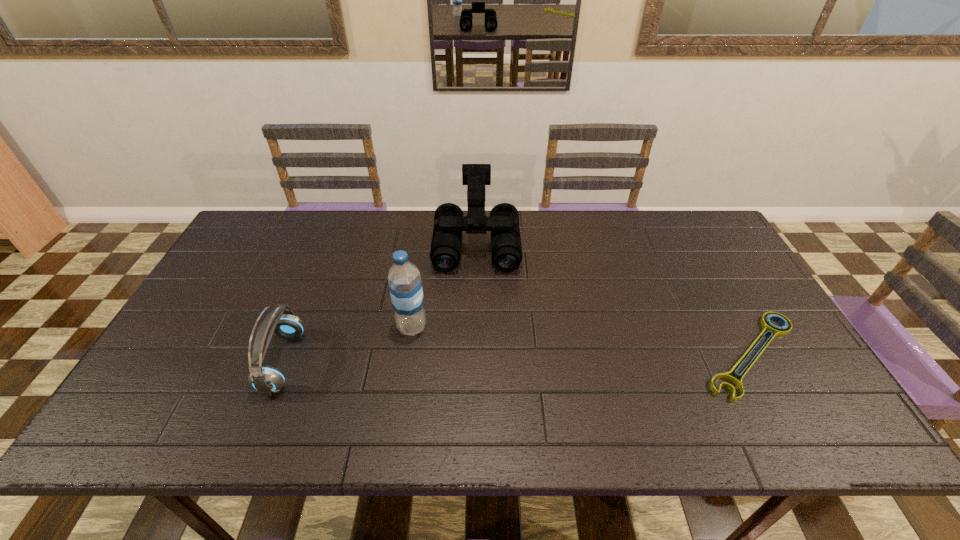
Find the location of a particular element. This screenshot has width=960, height=540. the leftmost object is located at coordinates (265, 379).

Locate an element on the screen. headset is located at coordinates (265, 379).

At what (x,y) coordinates should I click in order to perform the action: click on the rightmost object. Please return your answer as a coordinate pair (x, y). Looking at the image, I should click on (771, 329).

At what (x,y) coordinates should I click in order to perform the action: click on the shortest object. Please return your answer as a coordinate pair (x, y). Looking at the image, I should click on (771, 329).

At what (x,y) coordinates should I click in order to perform the action: click on water bottle. Please return your answer as a coordinate pair (x, y). Looking at the image, I should click on (405, 285).

You are a GUI agent. You are given a task and a screenshot of the screen. Output one action in this format:
    pyautogui.click(x=<x>, y=<y>)
    Task: Click on the binoculars
    This screenshot has height=540, width=960.
    Given the screenshot: What is the action you would take?
    pyautogui.click(x=506, y=249)

The image size is (960, 540). I want to click on the third shortest object, so click(506, 249).

Find the location of `vacant space located on the ear cups of the headset`. vacant space located on the ear cups of the headset is located at coordinates (216, 362).

The image size is (960, 540). Identify the location of free location located on the ear cups of the headset. (240, 362).

Image resolution: width=960 pixels, height=540 pixels. In order to click on free space located 0.110m on the ear cups of the headset in this screenshot , I will do `click(224, 362)`.